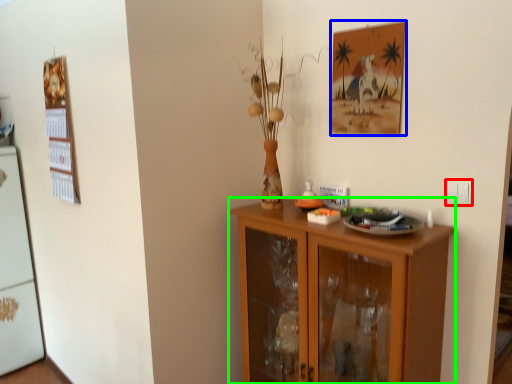
Question: Considering the real-world distances, which object is closest to electric outlet (highlighted by a red box)? picture frame (highlighted by a blue box) or cabinetry (highlighted by a green box).

Choices:
 (A) picture frame
 (B) cabinetry

Answer: (A)